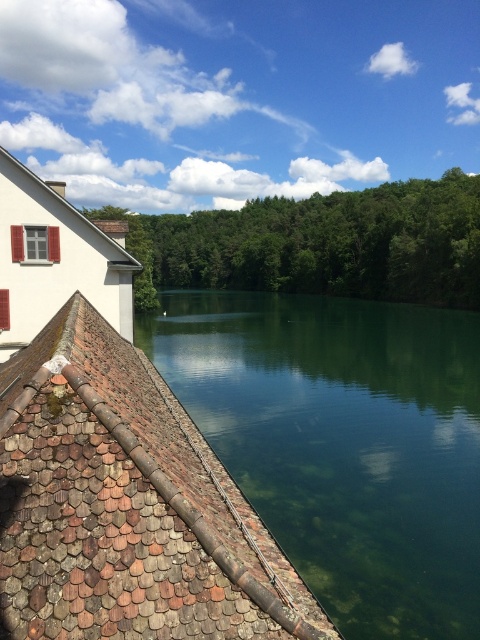
Question: Among these points, which one is nearest to the camera?

Choices:
 (A) coord(312,620)
 (B) coord(403,577)

Answer: (A)

Question: Among these points, which one is farthest from the camera?

Choices:
 (A) 39,378
 (B) 316,422

Answer: (B)

Question: Which of the following is the closest to the observer?

Choices:
 (A) green glassy water at center
 (B) brown tile roof at lower left

Answer: (B)

Question: Is the position of green glassy water at center less distant than that of brown tile roof at lower left?

Choices:
 (A) yes
 (B) no

Answer: (B)

Question: Is green glassy water at center below brown tile roof at lower left?

Choices:
 (A) no
 (B) yes

Answer: (A)

Question: Does green glassy water at center have a smaller size compared to brown tile roof at lower left?

Choices:
 (A) no
 (B) yes

Answer: (A)